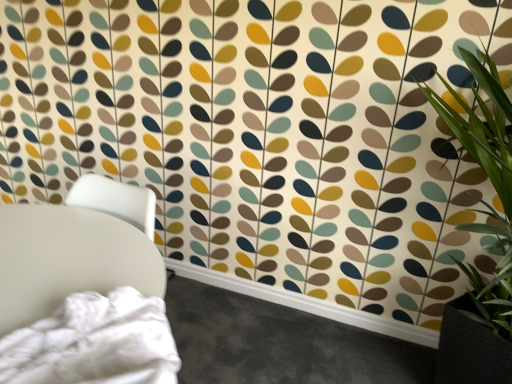
Question: Is white matte chair at left inside or outside of green leafy plant at right?

Choices:
 (A) inside
 (B) outside

Answer: (B)

Question: Is white matte chair at left wider or thinner than green leafy plant at right?

Choices:
 (A) thin
 (B) wide

Answer: (A)

Question: Considering the positions of point (19, 304) and point (468, 291), is point (19, 304) closer or farther from the camera than point (468, 291)?

Choices:
 (A) farther
 (B) closer

Answer: (B)

Question: Based on their sizes in the image, would you say green leafy plant at right is bigger or smaller than white matte chair at left?

Choices:
 (A) big
 (B) small

Answer: (A)

Question: Considering the positions of green leafy plant at right and white matte chair at left in the image, is green leafy plant at right wider or thinner than white matte chair at left?

Choices:
 (A) thin
 (B) wide

Answer: (B)

Question: From a real-world perspective, is green leafy plant at right positioned above or below white matte chair at left?

Choices:
 (A) below
 (B) above

Answer: (B)

Question: In the image, is green leafy plant at right positioned in front of or behind white matte chair at left?

Choices:
 (A) behind
 (B) front

Answer: (B)